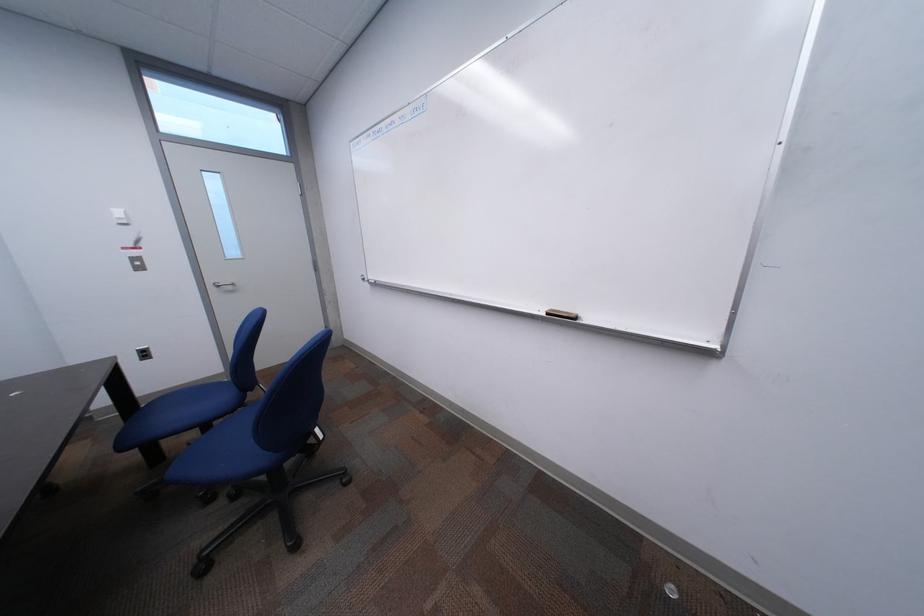
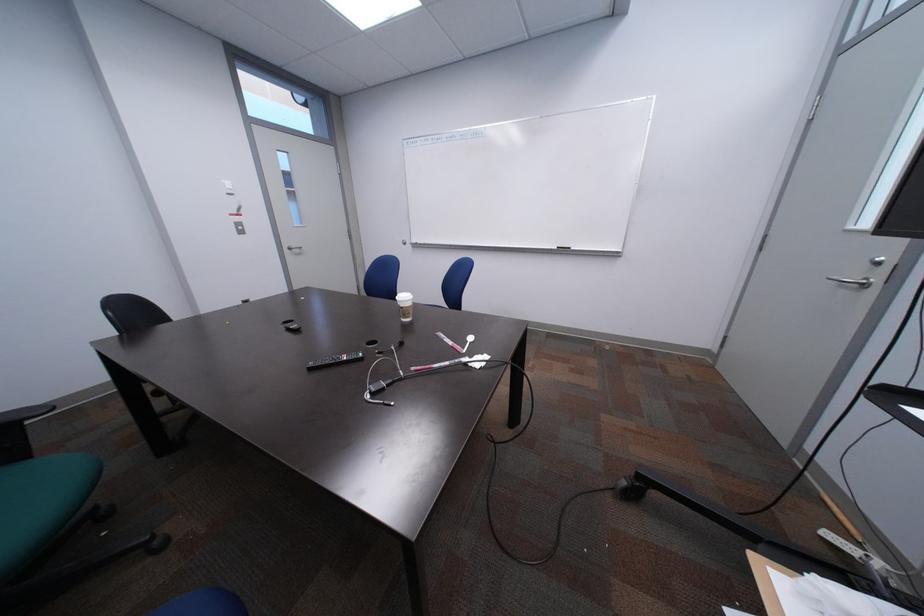
In a continuous first-person perspective shot, in which direction is the camera moving?

The cameraman moved toward left, backward.